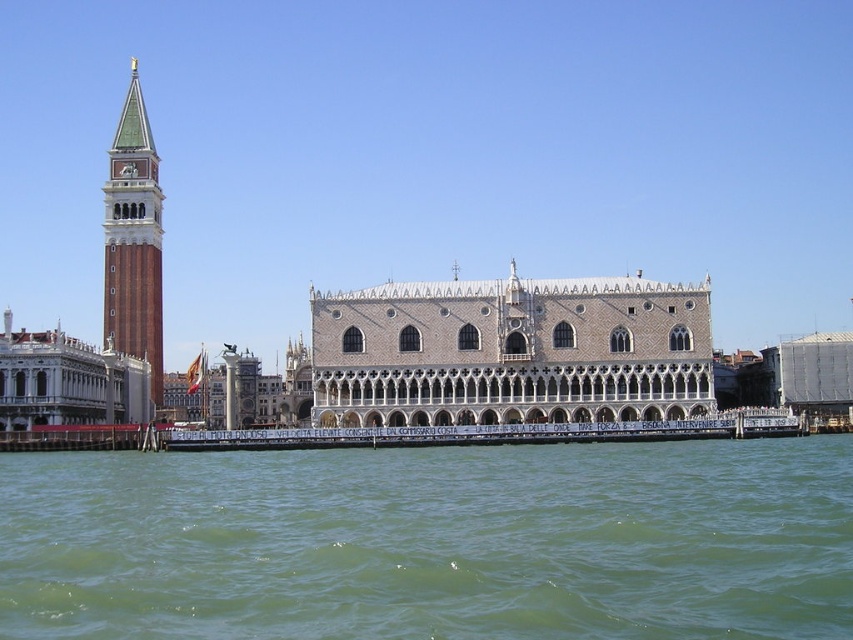
Consider the image. Can you confirm if green water at lower center is shorter than green-tiled bell tower at left?

Indeed, green water at lower center has a lesser height compared to green-tiled bell tower at left.

Between green water at lower center and green-tiled bell tower at left, which one has less height?

green water at lower center is shorter.

Between point (773, 625) and point (132, 344), which one is positioned behind?

The point (132, 344) is more distant.

Find the location of a particular element. The image size is (853, 640). green water at lower center is located at coordinates (432, 541).

Which of these two, white stone palace at center or green-tiled bell tower at left, stands taller?

With more height is green-tiled bell tower at left.

The width and height of the screenshot is (853, 640). Describe the element at coordinates (511, 352) in the screenshot. I see `white stone palace at center` at that location.

Find the location of a particular element. This screenshot has width=853, height=640. white stone palace at center is located at coordinates (511, 352).

Which is more to the left, green water at lower center or white stone palace at center?

From the viewer's perspective, green water at lower center appears more on the left side.

Consider the image. Does green water at lower center have a greater height compared to white stone palace at center?

In fact, green water at lower center may be shorter than white stone palace at center.

Where is `green water at lower center`? green water at lower center is located at coordinates (432, 541).